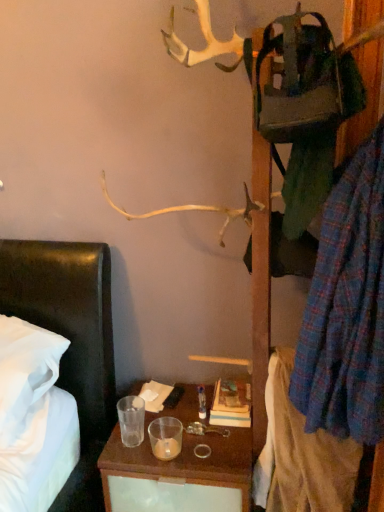
Question: Could you tell me if plaid fabric shirt at right, the 2th clothing positioned from the top, is facing plaid fabric shirt at right, which is counted as the second clothing, starting from the bottom?

Choices:
 (A) no
 (B) yes

Answer: (A)

Question: Does plaid fabric shirt at right, the 2th clothing positioned from the top, lie behind plaid fabric shirt at right, which is counted as the second clothing, starting from the bottom?

Choices:
 (A) no
 (B) yes

Answer: (B)

Question: From the image's perspective, is plaid fabric shirt at right, the 2th clothing positioned from the top, over plaid fabric shirt at right, which is the 1th clothing in top-to-bottom order?

Choices:
 (A) no
 (B) yes

Answer: (A)

Question: Does plaid fabric shirt at right, the 1th clothing when ordered from bottom to top, have a lesser width compared to plaid fabric shirt at right, which is the 1th clothing in top-to-bottom order?

Choices:
 (A) no
 (B) yes

Answer: (A)

Question: Considering the relative sizes of plaid fabric shirt at right, the 1th clothing when ordered from bottom to top, and plaid fabric shirt at right, which is counted as the second clothing, starting from the bottom, in the image provided, is plaid fabric shirt at right, the 1th clothing when ordered from bottom to top, taller than plaid fabric shirt at right, which is counted as the second clothing, starting from the bottom,?

Choices:
 (A) no
 (B) yes

Answer: (A)

Question: Is plaid fabric shirt at right, the 1th clothing when ordered from bottom to top, touching plaid fabric shirt at right, which is the 1th clothing in top-to-bottom order?

Choices:
 (A) no
 (B) yes

Answer: (A)

Question: Does plaid fabric shirt at right, which is counted as the second clothing, starting from the bottom, have a greater height compared to plaid fabric shirt at right, the 1th clothing when ordered from bottom to top?

Choices:
 (A) yes
 (B) no

Answer: (A)

Question: Is plaid fabric shirt at right, which is the 1th clothing in top-to-bottom order, closer to camera compared to plaid fabric shirt at right, the 2th clothing positioned from the top?

Choices:
 (A) no
 (B) yes

Answer: (B)

Question: Can you confirm if plaid fabric shirt at right, which is counted as the second clothing, starting from the bottom, is wider than plaid fabric shirt at right, the 2th clothing positioned from the top?

Choices:
 (A) no
 (B) yes

Answer: (A)

Question: Considering the relative sizes of plaid fabric shirt at right, which is counted as the second clothing, starting from the bottom, and plaid fabric shirt at right, the 1th clothing when ordered from bottom to top, in the image provided, is plaid fabric shirt at right, which is counted as the second clothing, starting from the bottom, shorter than plaid fabric shirt at right, the 1th clothing when ordered from bottom to top,?

Choices:
 (A) yes
 (B) no

Answer: (B)

Question: Is plaid fabric shirt at right, which is counted as the second clothing, starting from the bottom, bigger than plaid fabric shirt at right, the 2th clothing positioned from the top?

Choices:
 (A) yes
 (B) no

Answer: (A)

Question: Considering the relative sizes of plaid fabric shirt at right, which is counted as the second clothing, starting from the bottom, and plaid fabric shirt at right, the 1th clothing when ordered from bottom to top, in the image provided, is plaid fabric shirt at right, which is counted as the second clothing, starting from the bottom, thinner than plaid fabric shirt at right, the 1th clothing when ordered from bottom to top,?

Choices:
 (A) yes
 (B) no

Answer: (A)

Question: From the image's perspective, relative to plaid fabric shirt at right, which is counted as the second clothing, starting from the bottom, is plaid fabric shirt at right, the 1th clothing when ordered from bottom to top, above or below?

Choices:
 (A) below
 (B) above

Answer: (A)